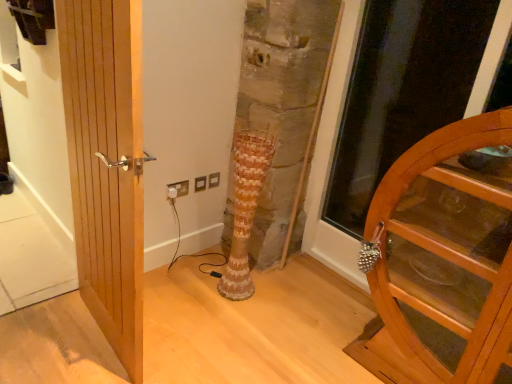
Find the location of `free space between brown textured vase at center and natural wood door at left, which is the first door from left to right`. free space between brown textured vase at center and natural wood door at left, which is the first door from left to right is located at coordinates (183, 315).